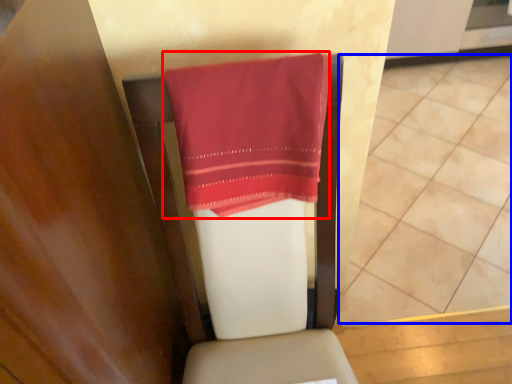
Question: Which point is closer to the camera, towel (highlighted by a red box) or tile (highlighted by a blue box)?

Choices:
 (A) towel
 (B) tile

Answer: (A)